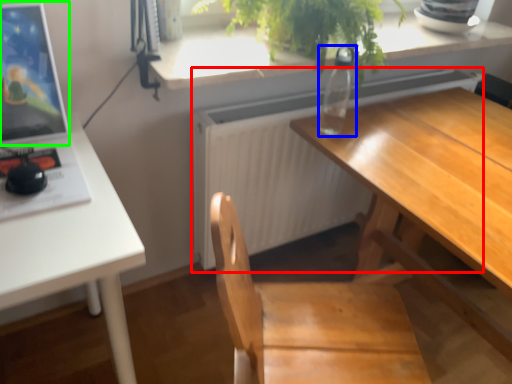
Question: Which is nearer to the radiator (highlighted by a red box)? bottle (highlighted by a blue box) or computer monitor (highlighted by a green box).

Choices:
 (A) bottle
 (B) computer monitor

Answer: (A)